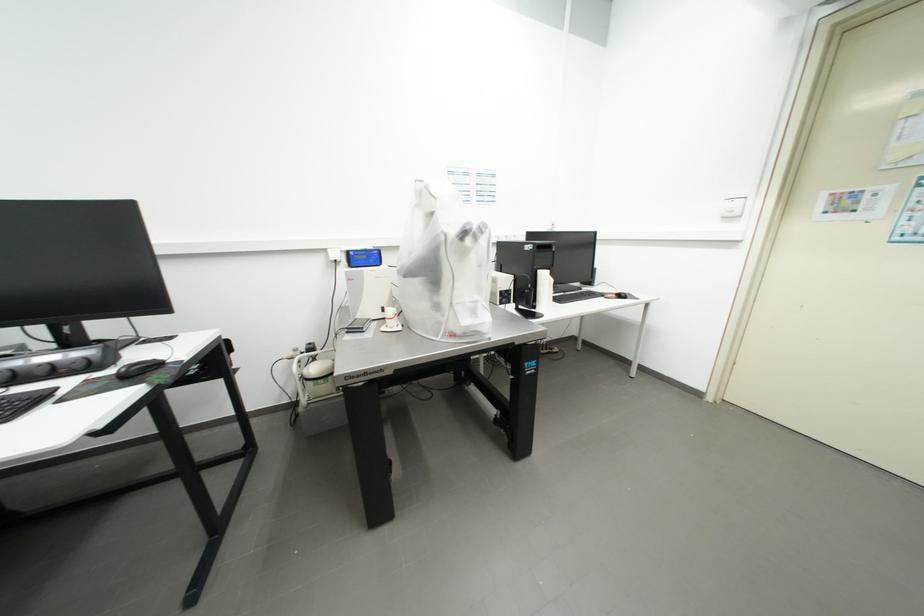
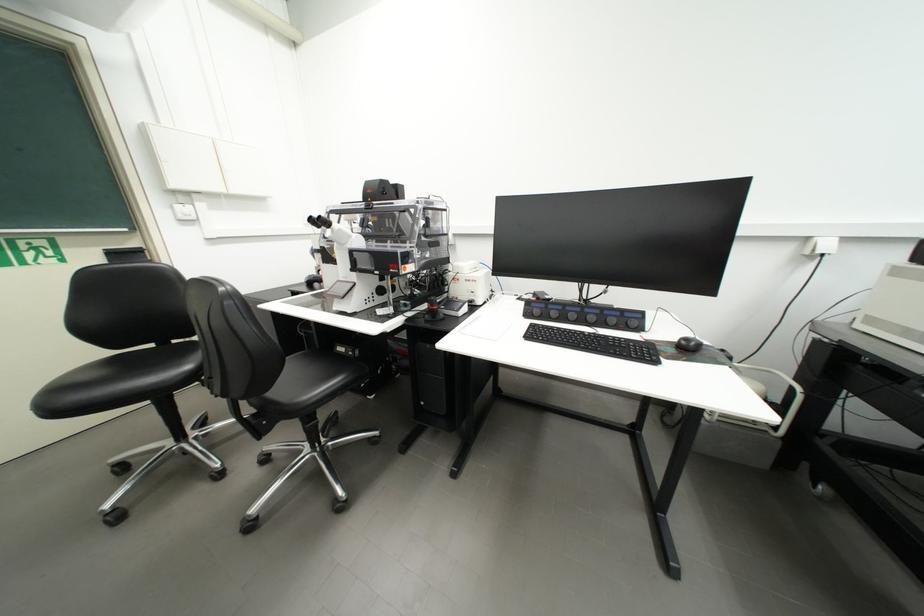
Where in the second image is the point corresponding to (148,376) from the first image?

(697, 351)